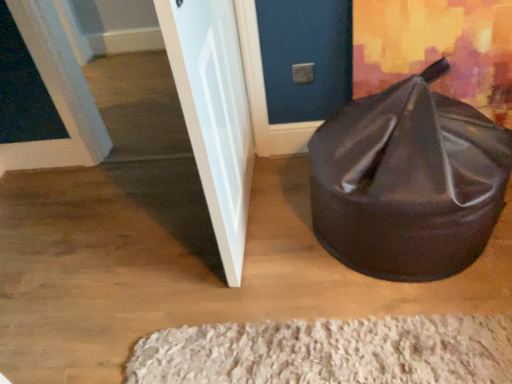
What do you see at coordinates (408, 181) in the screenshot? This screenshot has width=512, height=384. I see `black leather bean bag at lower right` at bounding box center [408, 181].

Describe the element at coordinates (214, 114) in the screenshot. I see `white glossy door at left, the second door from the left` at that location.

Where is `white painted wood door at upper left, which ranks as the first door in left-to-right order`? The width and height of the screenshot is (512, 384). white painted wood door at upper left, which ranks as the first door in left-to-right order is located at coordinates (56, 95).

Can you tell me how much black leather bean bag at lower right and white painted wood door at upper left, which ranks as the first door in left-to-right order, differ in facing direction?

They differ by 0.00107 degrees in their facing directions.

Considering the relative sizes of black leather bean bag at lower right and white painted wood door at upper left, which ranks as the first door in left-to-right order, in the image provided, is black leather bean bag at lower right thinner than white painted wood door at upper left, which ranks as the first door in left-to-right order,?

No.

Is point (457, 170) behind point (49, 166)?

That is False.

Is black leather bean bag at lower right positioned with its back to white painted wood door at upper left, which ranks as the first door in left-to-right order?

No.

The width and height of the screenshot is (512, 384). Identify the location of bean bag chair behind the white glossy door at left, the second door from the left. (408, 181).

How much distance is there between black leather bean bag at lower right and white glossy door at left, which is the 1th door in right-to-left order?

They are 19.58 inches apart.

Looking at this image, does black leather bean bag at lower right have a larger size compared to white glossy door at left, which is the 1th door in right-to-left order?

Indeed, black leather bean bag at lower right has a larger size compared to white glossy door at left, which is the 1th door in right-to-left order.

How different are the orientations of black leather bean bag at lower right and white glossy door at left, the second door from the left, in degrees?

They differ by 91.3 degrees in their facing directions.

Is black leather bean bag at lower right positioned in front of white shaggy rug at lower center?

That is True.

What are the coordinates of `bean bag chair on the right of white shaggy rug at lower center` in the screenshot? It's located at (408, 181).

Considering the points (399, 163) and (466, 376), which point is in front, point (399, 163) or point (466, 376)?

The point (466, 376) is in front.

Which is more to the left, black leather bean bag at lower right or white shaggy rug at lower center?

Positioned to the left is white shaggy rug at lower center.

Does point (205, 10) lie behind point (37, 18)?

No, it is not.

The height and width of the screenshot is (384, 512). I want to click on door below the white painted wood door at upper left, which appears as the second door when viewed from the right (from the image's perspective), so click(x=214, y=114).

From their relative heights in the image, would you say white glossy door at left, the second door from the left, is taller or shorter than white painted wood door at upper left, which appears as the second door when viewed from the right?

Considering their sizes, white glossy door at left, the second door from the left, has more height than white painted wood door at upper left, which appears as the second door when viewed from the right.

Is white glossy door at left, the second door from the left, in front of or behind white painted wood door at upper left, which appears as the second door when viewed from the right, in the image?

Visually, white glossy door at left, the second door from the left, is located in front of white painted wood door at upper left, which appears as the second door when viewed from the right.

Looking at this image, does white glossy door at left, which is the 1th door in right-to-left order, turn towards white shaggy rug at lower center?

No.

From the image's perspective, which one is positioned lower, white glossy door at left, which is the 1th door in right-to-left order, or white shaggy rug at lower center?

white shaggy rug at lower center, from the image's perspective.

What are the coordinates of `doormat below the white glossy door at left, the second door from the left (from the image's perspective)` in the screenshot? It's located at (330, 352).

Is white glossy door at left, the second door from the left, far from white shaggy rug at lower center?

white glossy door at left, the second door from the left, is actually quite close to white shaggy rug at lower center.

From the image's perspective, is white painted wood door at upper left, which appears as the second door when viewed from the right, located above black leather bean bag at lower right?

Indeed, from the image's perspective, white painted wood door at upper left, which appears as the second door when viewed from the right, is shown above black leather bean bag at lower right.

Is the surface of white painted wood door at upper left, which appears as the second door when viewed from the right, in direct contact with black leather bean bag at lower right?

No, white painted wood door at upper left, which appears as the second door when viewed from the right, is not with black leather bean bag at lower right.

Does point (90, 111) lie in front of point (443, 64)?

No, it is not.

Is white painted wood door at upper left, which appears as the second door when viewed from the right, to the left or to the right of black leather bean bag at lower right in the image?

white painted wood door at upper left, which appears as the second door when viewed from the right, is positioned on black leather bean bag at lower right's left side.

From a real-world perspective, is white shaggy rug at lower center under white glossy door at left, which is the 1th door in right-to-left order?

Correct, in the physical world, white shaggy rug at lower center is lower than white glossy door at left, which is the 1th door in right-to-left order.

Which object is positioned more to the left, white shaggy rug at lower center or white glossy door at left, the second door from the left?

From the viewer's perspective, white glossy door at left, the second door from the left, appears more on the left side.

In the image, is white shaggy rug at lower center positioned in front of or behind white glossy door at left, the second door from the left?

Visually, white shaggy rug at lower center is located behind white glossy door at left, the second door from the left.

Which is correct: white shaggy rug at lower center is inside white glossy door at left, which is the 1th door in right-to-left order, or outside of it?

white shaggy rug at lower center exists outside the volume of white glossy door at left, which is the 1th door in right-to-left order.

Find the location of a particular element. This screenshot has height=384, width=512. bean bag chair lying below the white painted wood door at upper left, which ranks as the first door in left-to-right order (from the image's perspective) is located at coordinates (408, 181).

You are a GUI agent. You are given a task and a screenshot of the screen. Output one action in this format:
    pyautogui.click(x=<x>, y=<y>)
    Task: Click on the bean bag chair directly beneath the white glossy door at left, which is the 1th door in right-to-left order (from a real-world perspective)
    
    Given the screenshot: What is the action you would take?
    pyautogui.click(x=408, y=181)

Based on their spatial positions, is white painted wood door at upper left, which appears as the second door when viewed from the right, or white shaggy rug at lower center closer to black leather bean bag at lower right?

The object closer to black leather bean bag at lower right is white shaggy rug at lower center.

Estimate the real-world distances between objects in this image. Which object is further from white painted wood door at upper left, which appears as the second door when viewed from the right, black leather bean bag at lower right or white glossy door at left, the second door from the left?

black leather bean bag at lower right lies further to white painted wood door at upper left, which appears as the second door when viewed from the right, than the other object.

When comparing their distances from white glossy door at left, the second door from the left, does white painted wood door at upper left, which ranks as the first door in left-to-right order, or black leather bean bag at lower right seem further?

white painted wood door at upper left, which ranks as the first door in left-to-right order.

When comparing their distances from black leather bean bag at lower right, does white painted wood door at upper left, which appears as the second door when viewed from the right, or white glossy door at left, which is the 1th door in right-to-left order, seem further?

white painted wood door at upper left, which appears as the second door when viewed from the right.

From the image, which object appears to be farther from white glossy door at left, which is the 1th door in right-to-left order, black leather bean bag at lower right or white shaggy rug at lower center?

Among the two, white shaggy rug at lower center is located further to white glossy door at left, which is the 1th door in right-to-left order.

Considering their positions, is white glossy door at left, the second door from the left, positioned further to black leather bean bag at lower right than white painted wood door at upper left, which appears as the second door when viewed from the right?

The object further to black leather bean bag at lower right is white painted wood door at upper left, which appears as the second door when viewed from the right.

When comparing their distances from white shaggy rug at lower center, does white painted wood door at upper left, which ranks as the first door in left-to-right order, or black leather bean bag at lower right seem closer?

black leather bean bag at lower right lies closer to white shaggy rug at lower center than the other object.

From the image, which object appears to be farther from white painted wood door at upper left, which ranks as the first door in left-to-right order, white shaggy rug at lower center or black leather bean bag at lower right?

Among the two, black leather bean bag at lower right is located further to white painted wood door at upper left, which ranks as the first door in left-to-right order.

The height and width of the screenshot is (384, 512). I want to click on doormat between white painted wood door at upper left, which appears as the second door when viewed from the right, and black leather bean bag at lower right, in the horizontal direction, so click(x=330, y=352).

The image size is (512, 384). I want to click on door situated between white painted wood door at upper left, which ranks as the first door in left-to-right order, and black leather bean bag at lower right from left to right, so click(x=214, y=114).

Where is `door between white painted wood door at upper left, which appears as the second door when viewed from the right, and white shaggy rug at lower center vertically`? The width and height of the screenshot is (512, 384). door between white painted wood door at upper left, which appears as the second door when viewed from the right, and white shaggy rug at lower center vertically is located at coordinates (214, 114).

The width and height of the screenshot is (512, 384). I want to click on bean bag chair between white glossy door at left, which is the 1th door in right-to-left order, and white shaggy rug at lower center, in the vertical direction, so [x=408, y=181].